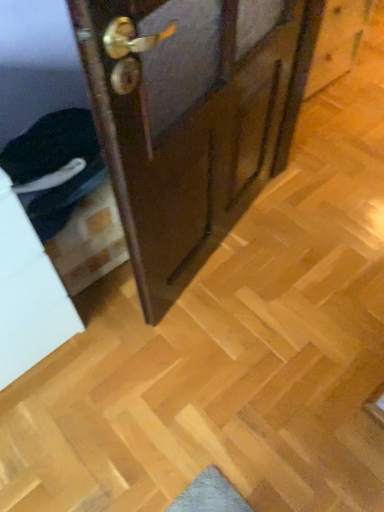
Question: From a real-world perspective, is wooden door at center positioned under white matte drawer at lower left based on gravity?

Choices:
 (A) no
 (B) yes

Answer: (A)

Question: Considering the relative sizes of wooden door at center and white matte drawer at lower left in the image provided, is wooden door at center wider than white matte drawer at lower left?

Choices:
 (A) no
 (B) yes

Answer: (A)

Question: Is wooden door at center positioned beyond the bounds of white matte drawer at lower left?

Choices:
 (A) no
 (B) yes

Answer: (B)

Question: Is wooden door at center to the left of white matte drawer at lower left from the viewer's perspective?

Choices:
 (A) no
 (B) yes

Answer: (A)

Question: Is wooden door at center oriented away from white matte drawer at lower left?

Choices:
 (A) no
 (B) yes

Answer: (A)

Question: From the image's perspective, is wooden door at center on top of white matte drawer at lower left?

Choices:
 (A) no
 (B) yes

Answer: (B)

Question: Can you confirm if white matte drawer at lower left is thinner than wooden door at center?

Choices:
 (A) no
 (B) yes

Answer: (A)

Question: Does white matte drawer at lower left appear on the right side of wooden door at center?

Choices:
 (A) yes
 (B) no

Answer: (B)

Question: Does white matte drawer at lower left come behind wooden door at center?

Choices:
 (A) yes
 (B) no

Answer: (A)

Question: Is white matte drawer at lower left positioned in front of wooden door at center?

Choices:
 (A) yes
 (B) no

Answer: (B)

Question: From a real-world perspective, is white matte drawer at lower left under wooden door at center?

Choices:
 (A) no
 (B) yes

Answer: (B)

Question: Is white matte drawer at lower left next to wooden door at center and touching it?

Choices:
 (A) no
 (B) yes

Answer: (A)

Question: Considering the positions of wooden door at center and white matte drawer at lower left in the image, is wooden door at center bigger or smaller than white matte drawer at lower left?

Choices:
 (A) big
 (B) small

Answer: (B)